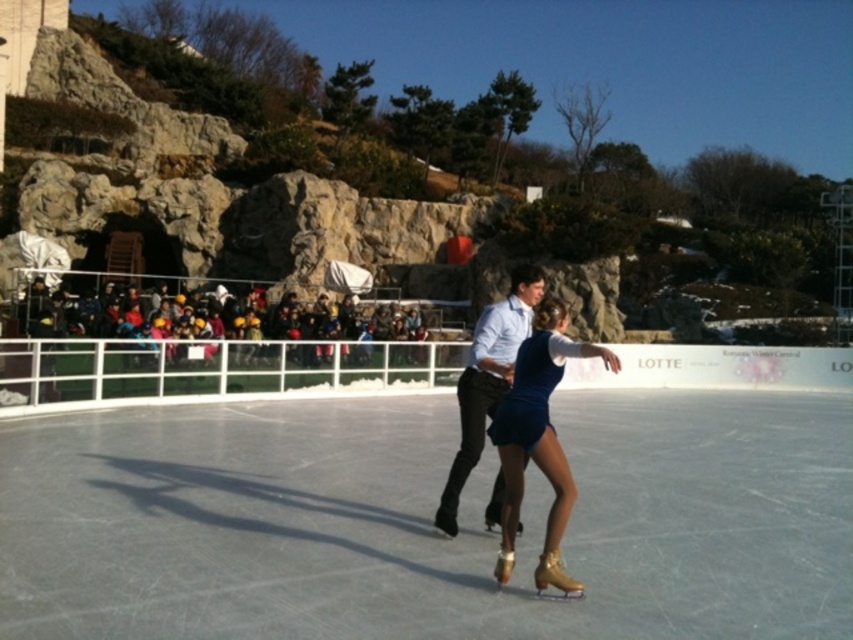
You are standing at the edge of the ice rink and see the point marked at coordinates (x=540, y=435). What object is this point located on?

The point marked at coordinates (x=540, y=435) is located on the shiny gold ice skate at center.

You are a photographer standing at the edge of the ice rink. You want to take a closeup photo of the shiny gold ice skate at center. According to the coordinates provided, where should you aim your camera to capture it?

You should aim your camera at point 0.680 on the horizontal axis and 0.634 on the vertical axis to capture the shiny gold ice skate at center.